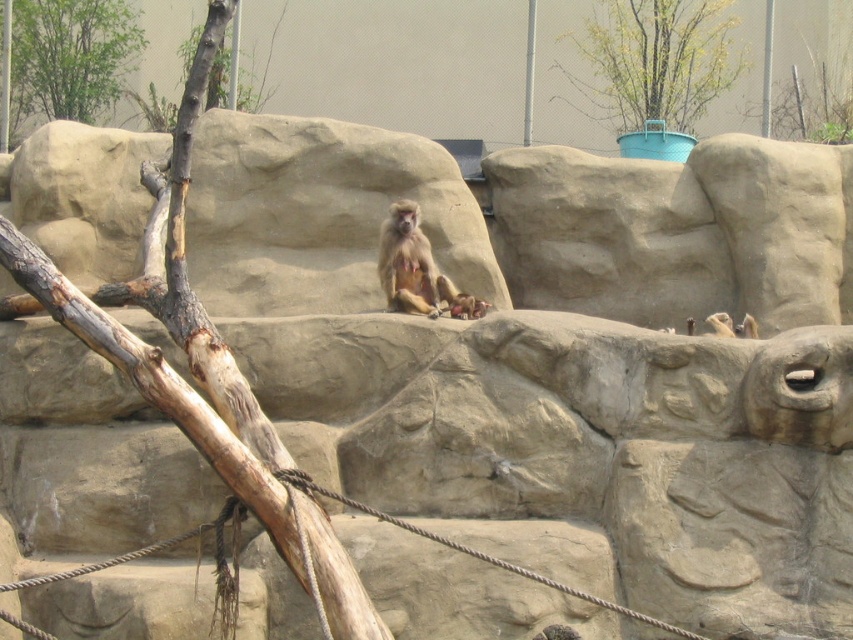
In the zoo enclosure, there are two monkeys sitting on the rocks. The golden fur monkey at center and the brown furry monkey at center. Which monkey is positioned to the left?

The golden fur monkey at center is positioned to the left of the brown furry monkey at center.

You are a zookeeper planning to place a new feeding station in the enclosure. The feeding station needs to be taller than the green plastic pot at upper center but shorter than the green leafy tree at upper left. Is this possible?

The green plastic pot at upper center is shorter than the green leafy tree at upper left, so yes, it is possible to place a feeding station that is taller than the green plastic pot at upper center but shorter than the green leafy tree at upper left.